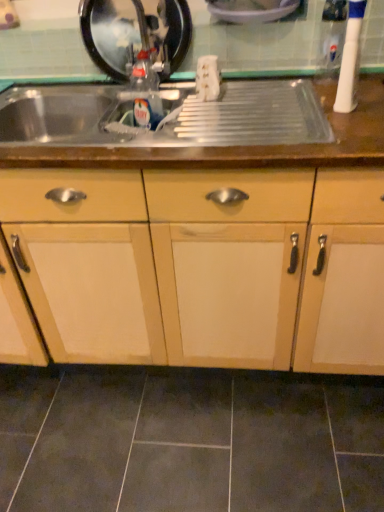
This screenshot has width=384, height=512. Find the location of `free space to the back side of white plastic toothbrush at upper right, the 1th appliance viewed from the right`. free space to the back side of white plastic toothbrush at upper right, the 1th appliance viewed from the right is located at coordinates (304, 93).